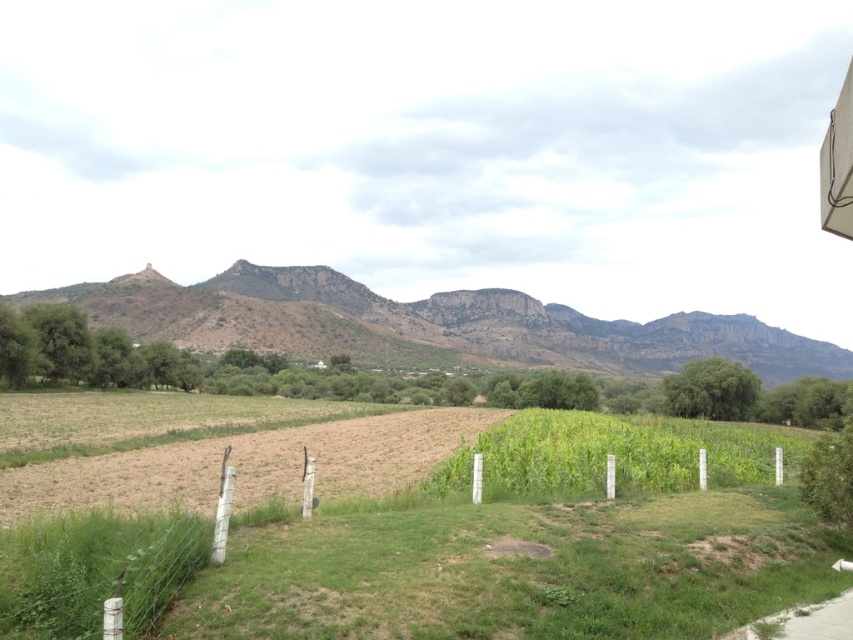
Question: Can you confirm if dull brown rock at center is positioned to the right of green plastic fence at center?

Choices:
 (A) no
 (B) yes

Answer: (B)

Question: Can you confirm if green grassy vineyard at center is positioned to the right of green plastic fence at center?

Choices:
 (A) yes
 (B) no

Answer: (B)

Question: Which point appears closest to the camera in this image?

Choices:
 (A) (247, 269)
 (B) (283, 484)

Answer: (B)

Question: Which object appears farthest from the camera in this image?

Choices:
 (A) green plastic fence at center
 (B) green grassy vineyard at center

Answer: (A)

Question: Which object is the farthest from the green plastic fence at center?

Choices:
 (A) dull brown rock at center
 (B) green grassy vineyard at center

Answer: (A)

Question: Observing the image, what is the correct spatial positioning of green grassy vineyard at center in reference to green plastic fence at center?

Choices:
 (A) right
 (B) left

Answer: (B)